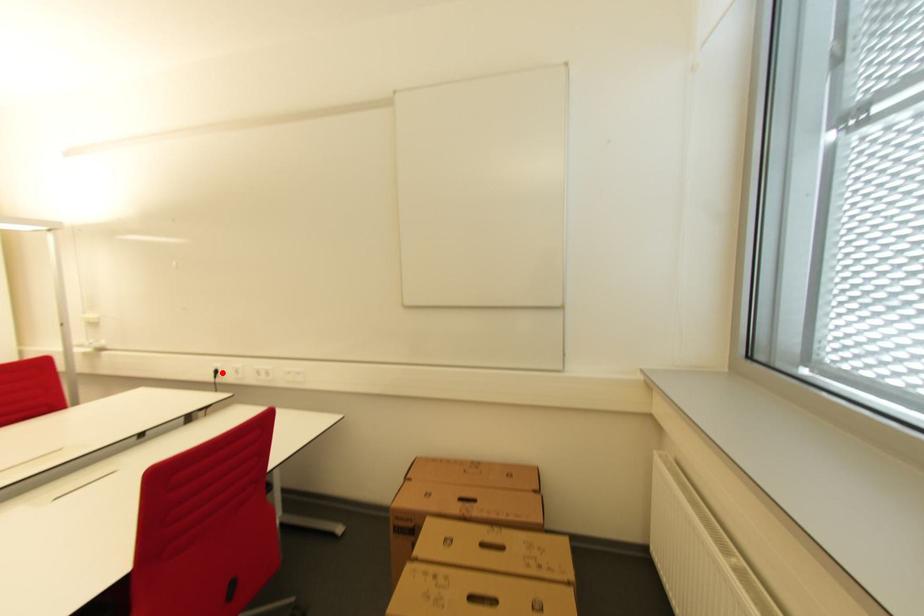
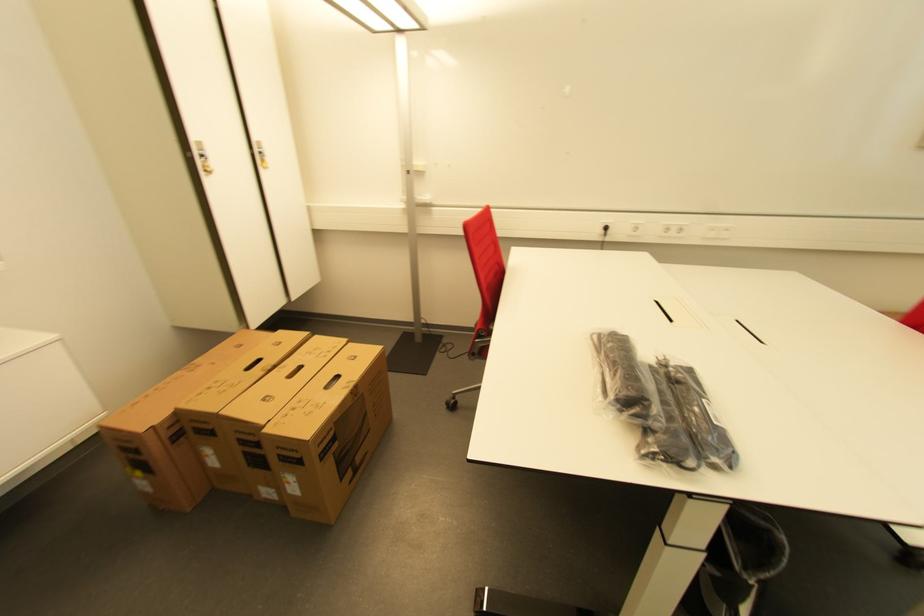
Question: I am providing you with two images of the same scene from different viewpoints. Image1 has a red point marked. In image2, the corresponding 3D location appears at what relative position? Reply with the corresponding letter.

Choices:
 (A) Closer
 (B) Farther

Answer: (A)